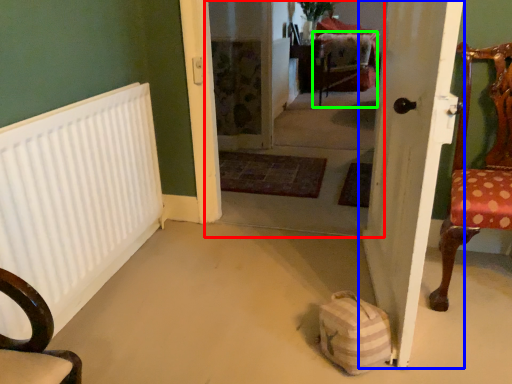
Question: Considering the real-world distances, which object is closest to corridor (highlighted by a red box)? door (highlighted by a blue box) or armchair (highlighted by a green box).

Choices:
 (A) door
 (B) armchair

Answer: (B)